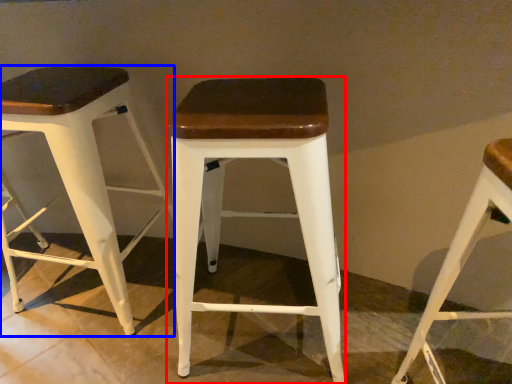
Question: Which point is closer to the camera, stool (highlighted by a red box) or stool (highlighted by a blue box)?

Choices:
 (A) stool
 (B) stool

Answer: (A)